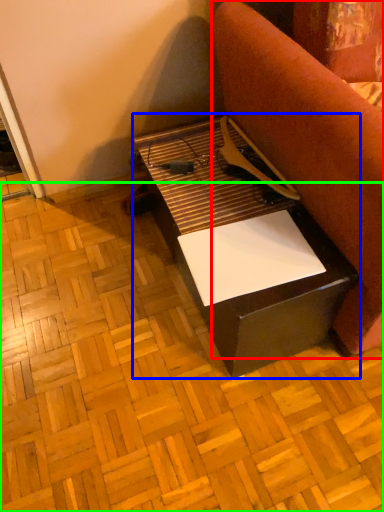
Question: Estimate the real-world distances between objects in this image. Which object is closer to furniture (highlighted by a red box), table (highlighted by a blue box) or plywood (highlighted by a green box)?

Choices:
 (A) table
 (B) plywood

Answer: (A)